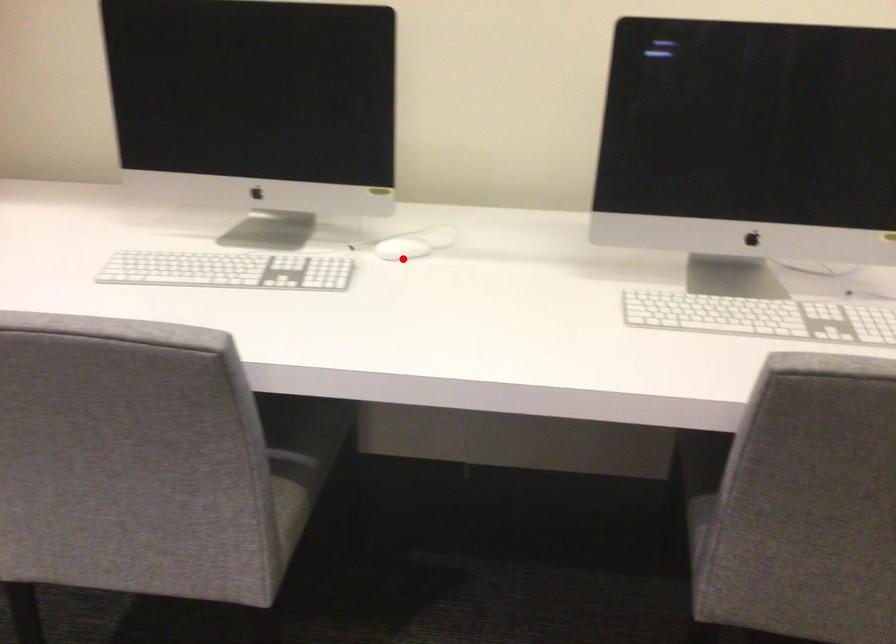
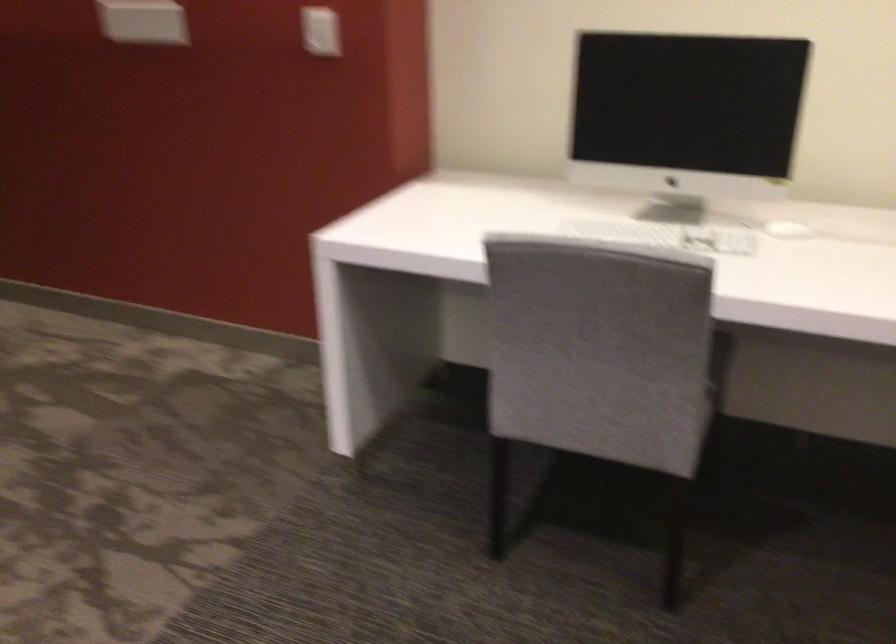
Question: I am providing you with two images of the same scene from different viewpoints. A red point is marked on the first image. Can you still see the location of the red point in image 2?

Choices:
 (A) Yes
 (B) No

Answer: (A)